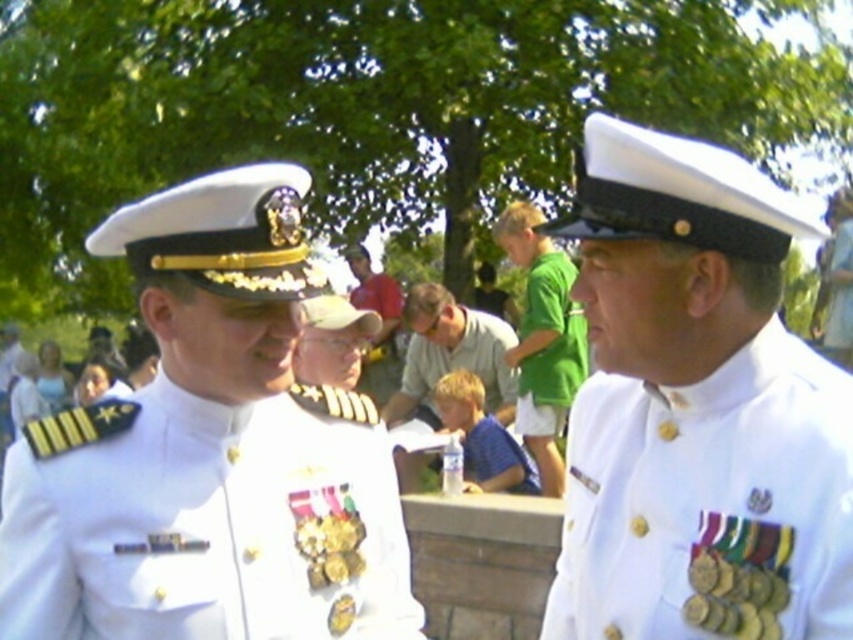
Question: Does white glossy uniform at center have a smaller size compared to white matte uniform at right?

Choices:
 (A) yes
 (B) no

Answer: (A)

Question: Which object is closer to the camera taking this photo?

Choices:
 (A) green cotton shirt at center
 (B) white matte uniform at right

Answer: (B)

Question: Among these objects, which one is farthest from the camera?

Choices:
 (A) white matte uniform at right
 (B) green cotton shirt at center
 (C) green cotton shirt at upper center
 (D) white glossy uniform at center

Answer: (B)

Question: Which point is farther to the camera?

Choices:
 (A) (560, 404)
 (B) (370, 532)
 (C) (659, 390)
 (D) (583, 376)

Answer: (D)

Question: Does white glossy uniform at center have a greater width compared to green cotton shirt at center?

Choices:
 (A) yes
 (B) no

Answer: (A)

Question: Can you confirm if white glossy uniform at center is positioned above green cotton shirt at upper center?

Choices:
 (A) yes
 (B) no

Answer: (B)